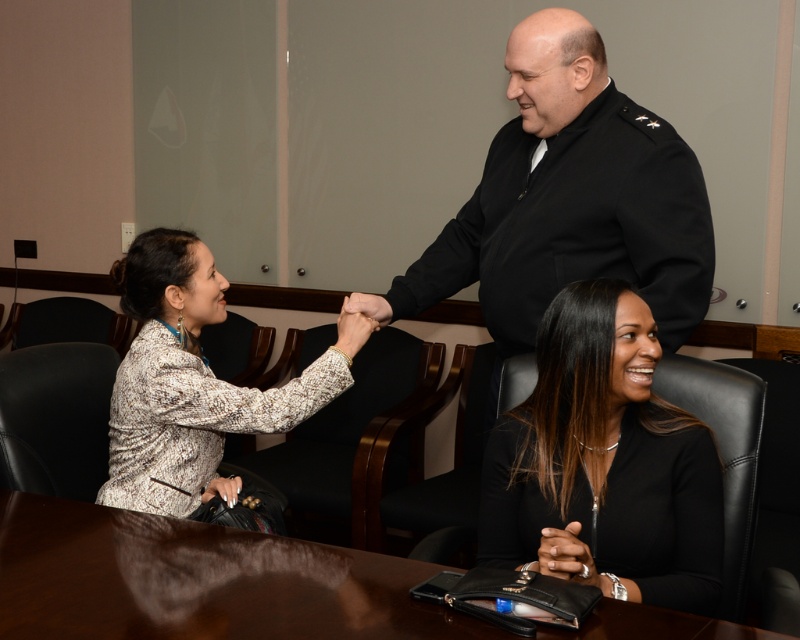
You are a photographer setting up for a professional photo shoot in this conference room. You need to position a light source to the right of the brown wooden table at lower center and to the left of the patterned fabric blouse at left. Is this possible given their arrangement?

The brown wooden table at lower center is positioned on the right side of the patterned fabric blouse at left, so placing a light source to the right of the table would also place it further to the right of the blouse, making it impossible to satisfy both conditions simultaneously.

You are organizing a meeting and need to ensure there is enough space between the black leather chair at lower right and the brown wooden table at lower center for attendees to comfortably move around. Based on the scene description, can you determine if the space between them is sufficient?

The black leather chair at lower right has a smaller width than the brown wooden table at lower center. However, the exact distance between them isn not specified in the provided information. To determine if the space is sufficient for comfortable movement, additional details about the distance or available clearance would be needed.

Looking at this image, you are a photographer setting up for a professional photoshoot in this conference room. You need to ensure that the brown wooden table at lower center does not block the view of the patterned fabric blouse at left in the final shot. Based on the scene description, can you position yourself in a way to achieve this?

The brown wooden table at lower center is in front of the patterned fabric blouse at left, so positioning yourself behind the table would allow you to capture the blouse without obstruction.